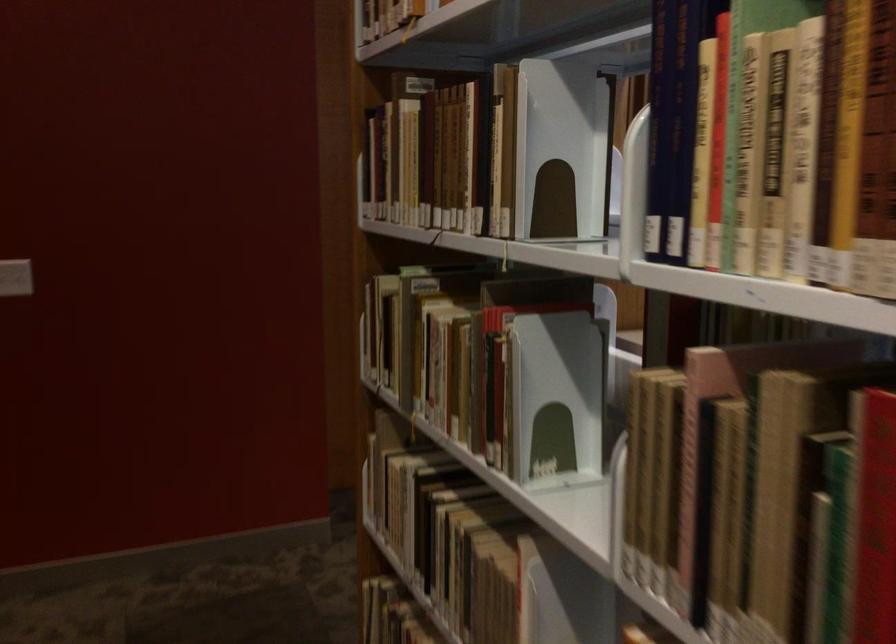
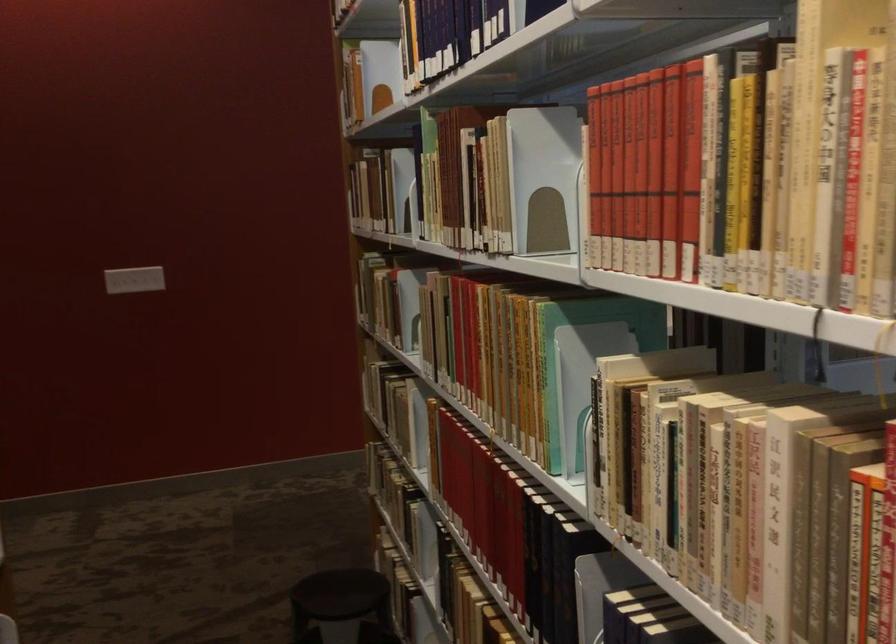
Question: I am providing you with two images of the same scene from different viewpoints. Please identify which objects are invisible in image2.

Choices:
 (A) white bookend
 (B) stool sitting surface
 (C) yellow book
 (D) microwave top handle

Answer: (A)